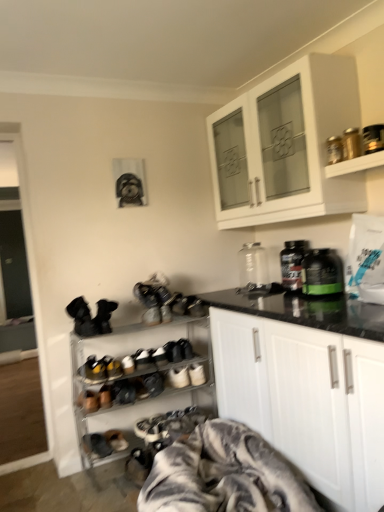
Question: Is there a large distance between white matte cabinet at upper center, which is the second cabinetry in bottom-to-top order, and black plastic bottle at center, the 2th bottle from the back?

Choices:
 (A) yes
 (B) no

Answer: (B)

Question: Is white matte cabinet at upper center, which is the second cabinetry in bottom-to-top order, shorter than black plastic bottle at center, the 2th bottle from the back?

Choices:
 (A) no
 (B) yes

Answer: (A)

Question: From the image's perspective, is white matte cabinet at upper center, which is the second cabinetry in bottom-to-top order, on black plastic bottle at center, which appears as the 2th bottle when viewed from the front?

Choices:
 (A) yes
 (B) no

Answer: (A)

Question: Is white matte cabinet at upper center, arranged as the first cabinetry when viewed from the top, positioned before black plastic bottle at center, which appears as the 2th bottle when viewed from the front?

Choices:
 (A) yes
 (B) no

Answer: (A)

Question: From a real-world perspective, is white matte cabinet at upper center, which is the second cabinetry in bottom-to-top order, located beneath black plastic bottle at center, which appears as the 2th bottle when viewed from the front?

Choices:
 (A) yes
 (B) no

Answer: (B)

Question: Considering the relative positions of leather sneakers at center, the fourth footwear when ordered from top to bottom, and metallic silver shoe rack at lower left, the 1th shelf in the left-to-right sequence, in the image provided, is leather sneakers at center, the fourth footwear when ordered from top to bottom, to the left or to the right of metallic silver shoe rack at lower left, the 1th shelf in the left-to-right sequence,?

Choices:
 (A) left
 (B) right

Answer: (A)

Question: Is leather sneakers at center, the third footwear from the left, wider or thinner than metallic silver shoe rack at lower left, the first shelf viewed from the back?

Choices:
 (A) wide
 (B) thin

Answer: (B)

Question: From the image's perspective, is leather sneakers at center, the fourth footwear when ordered from top to bottom, positioned above or below metallic silver shoe rack at lower left, positioned as the first shelf in bottom-to-top order?

Choices:
 (A) below
 (B) above

Answer: (A)

Question: Considering their positions, is leather sneakers at center, which is the second footwear in right-to-left order, located in front of or behind metallic silver shoe rack at lower left, which is the second shelf from front to back?

Choices:
 (A) front
 (B) behind

Answer: (B)

Question: Looking at the image, does gray textured blanket at lower center seem bigger or smaller compared to green matte bottle at right, the 3th bottle positioned from the back?

Choices:
 (A) big
 (B) small

Answer: (A)

Question: From the image's perspective, is gray textured blanket at lower center above or below green matte bottle at right, arranged as the 1th bottle when viewed from the front?

Choices:
 (A) below
 (B) above

Answer: (A)

Question: Is point 226,504 positioned closer to the camera than point 327,284?

Choices:
 (A) farther
 (B) closer

Answer: (B)

Question: Considering the positions of gray textured blanket at lower center and green matte bottle at right, arranged as the 1th bottle when viewed from the front, in the image, is gray textured blanket at lower center taller or shorter than green matte bottle at right, arranged as the 1th bottle when viewed from the front,?

Choices:
 (A) tall
 (B) short

Answer: (A)

Question: Which is correct: green matte bottle at right, arranged as the 1th bottle when viewed from the front, is inside white matte cabinet at upper center, arranged as the first cabinetry when viewed from the top, or outside of it?

Choices:
 (A) inside
 (B) outside

Answer: (B)

Question: Considering the positions of point (317, 254) and point (288, 122), is point (317, 254) closer or farther from the camera than point (288, 122)?

Choices:
 (A) closer
 (B) farther

Answer: (A)